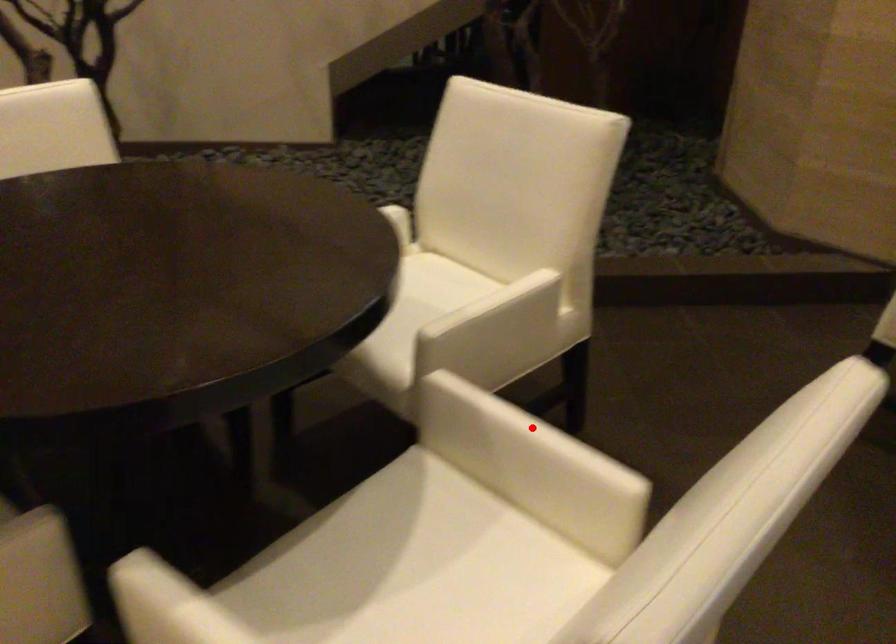
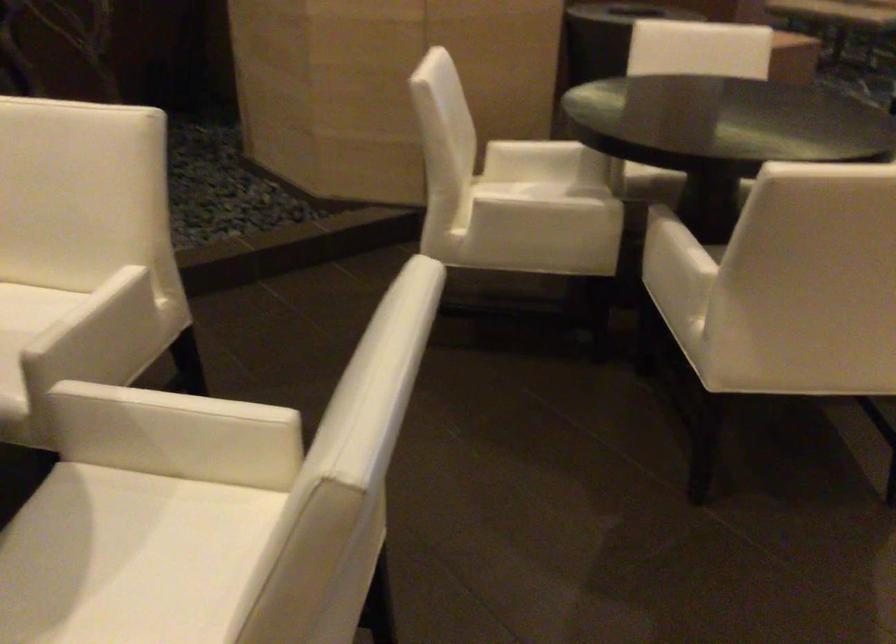
Where in the second image is the point corresponding to the highlighted location from the first image?

(179, 402)